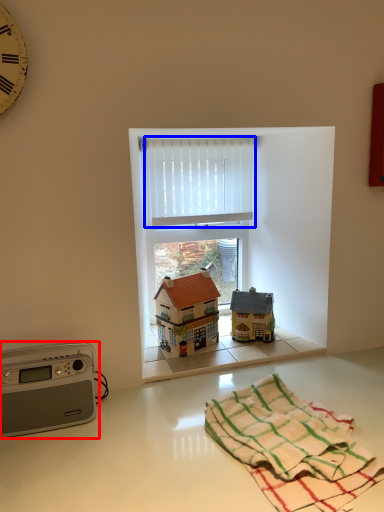
Question: Which object is further to the camera taking this photo, appliance (highlighted by a red box) or curtain (highlighted by a blue box)?

Choices:
 (A) appliance
 (B) curtain

Answer: (B)